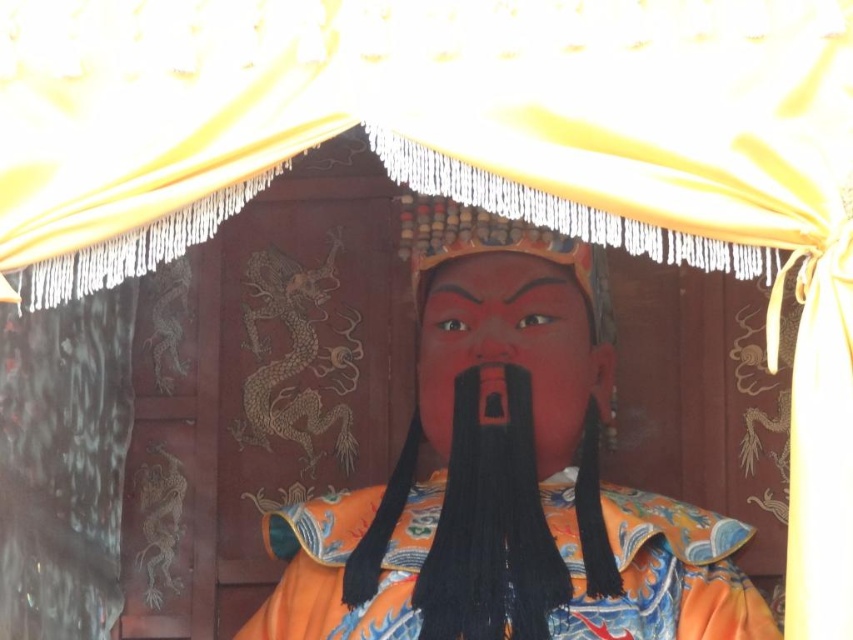
Question: From the image, what is the correct spatial relationship of orange satin robe at center in relation to matte red nose at center?

Choices:
 (A) left
 (B) right

Answer: (B)

Question: Among these objects, which one is nearest to the camera?

Choices:
 (A) matte orange robe at center
 (B) orange satin robe at center
 (C) yellow fabric canopy at upper center
 (D) matte red nose at center

Answer: (C)

Question: Does matte orange robe at center lie in front of matte red nose at center?

Choices:
 (A) no
 (B) yes

Answer: (B)

Question: Estimate the real-world distances between objects in this image. Which object is closer to the matte red nose at center?

Choices:
 (A) yellow fabric canopy at upper center
 (B) matte orange robe at center
 (C) orange satin robe at center

Answer: (B)

Question: Which of the following is the farthest from the observer?

Choices:
 (A) matte black beard at center
 (B) matte red nose at center
 (C) matte orange robe at center
 (D) orange satin robe at center

Answer: (B)

Question: Is yellow fabric canopy at upper center bigger than matte orange robe at center?

Choices:
 (A) no
 (B) yes

Answer: (A)